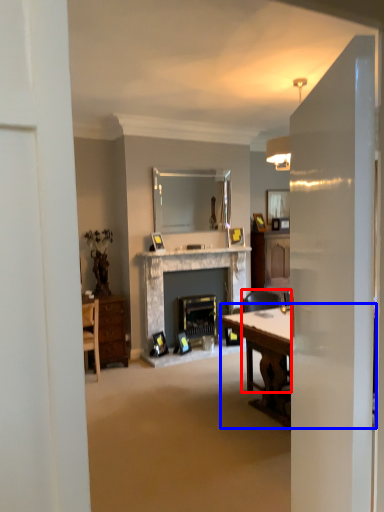
Question: Which object appears farthest to the camera in this image, chair (highlighted by a red box) or table (highlighted by a blue box)?

Choices:
 (A) chair
 (B) table

Answer: (A)